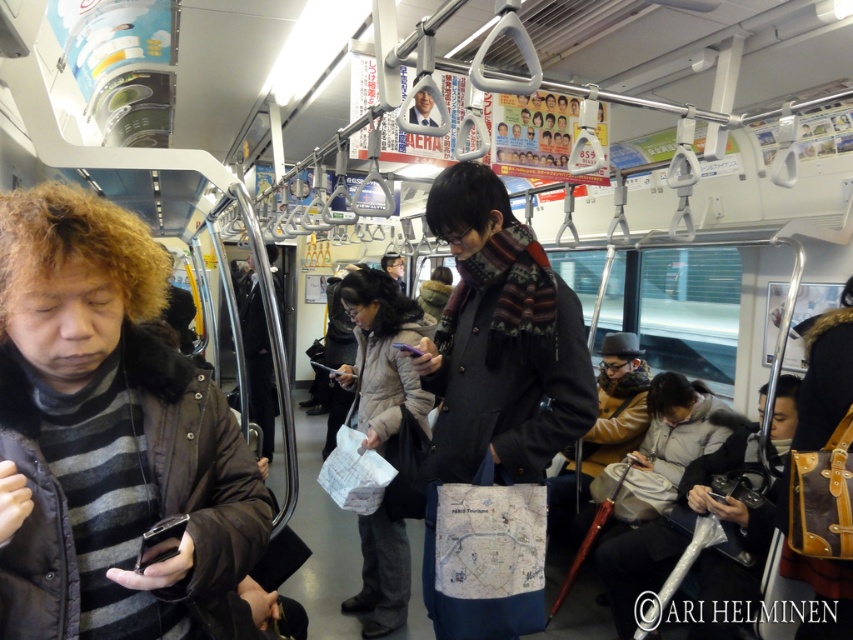
Question: Is dark gray fabric bag at center positioned before dark gray wool scarf at center?

Choices:
 (A) yes
 (B) no

Answer: (A)

Question: Is the position of striped wool sweater at left more distant than that of dark gray fabric jacket at center?

Choices:
 (A) yes
 (B) no

Answer: (B)

Question: Among these points, which one is farthest from the camera?

Choices:
 (A) (564, 472)
 (B) (405, 298)
 (C) (248, 380)
 (D) (135, 372)

Answer: (C)

Question: Which point appears farthest from the camera in this image?

Choices:
 (A) (260, 333)
 (B) (393, 518)
 (C) (144, 586)

Answer: (A)

Question: Among these objects, which one is farthest from the camera?

Choices:
 (A) dark gray fabric jacket at center
 (B) white paper map at center
 (C) dark gray wool scarf at center

Answer: (C)

Question: Where is tan leather jacket at center located in relation to dark gray fabric jacket at center in the image?

Choices:
 (A) right
 (B) left

Answer: (A)